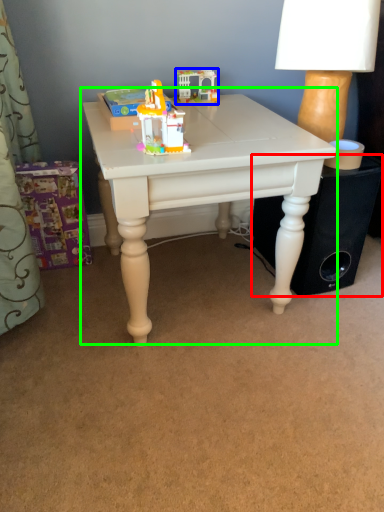
Question: Which object is the farthest from speaker (highlighted by a red box)? Choose among these: toy (highlighted by a blue box) or table (highlighted by a green box).

Choices:
 (A) toy
 (B) table

Answer: (A)